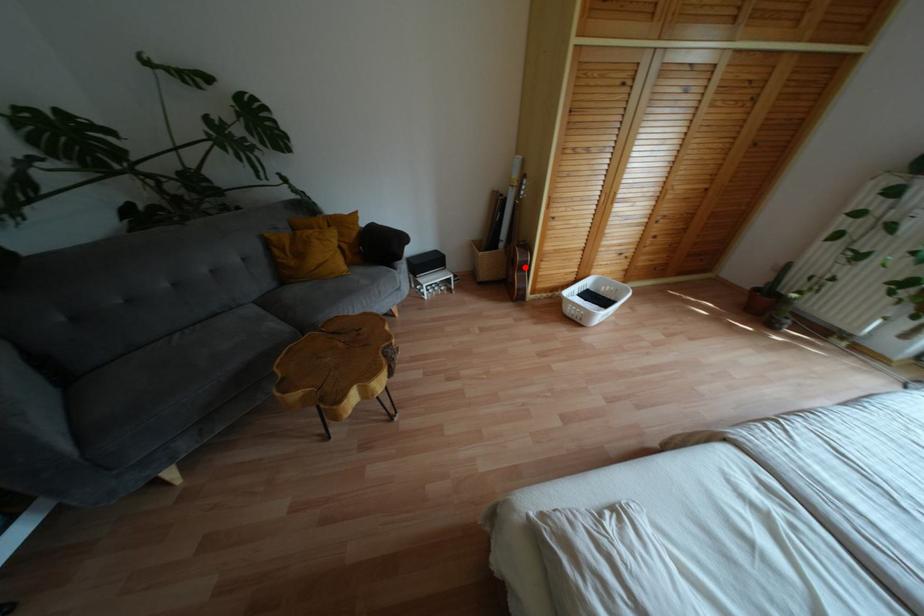
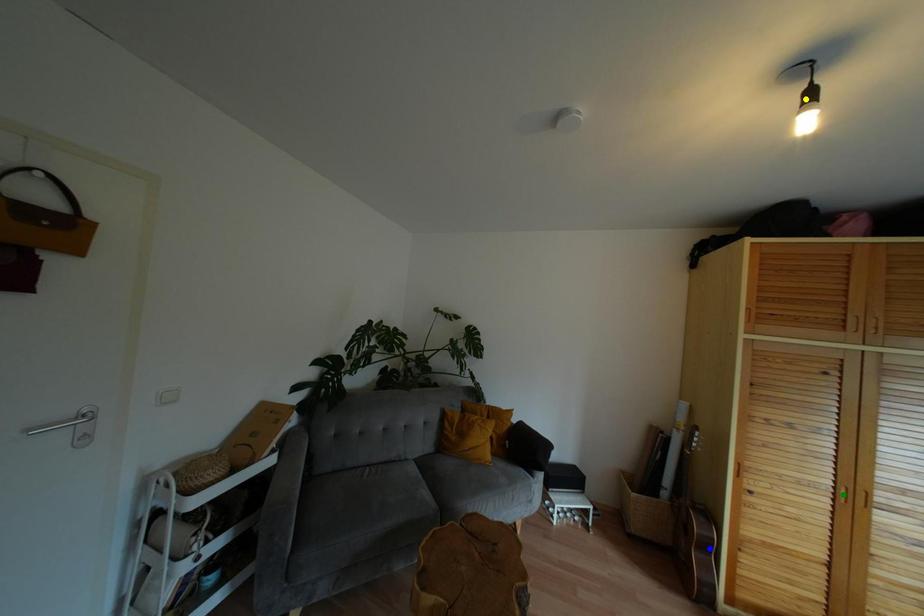
Question: I am providing you with two images of the same scene from different viewpoints. A red point is marked on the first image. You are given multiple points on the second image. Can you choose the point in image 2 that corresponds to the point in image 1?

Choices:
 (A) yellow point
 (B) blue point
 (C) green point

Answer: (B)